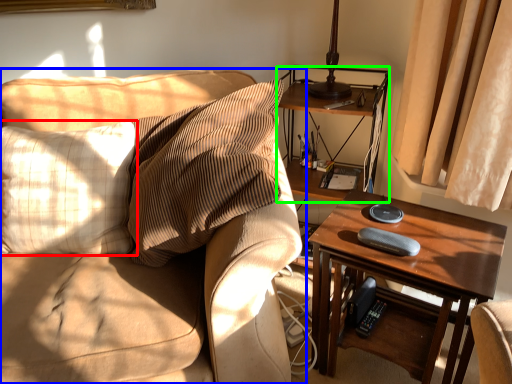
Question: Considering the real-world distances, which object is closest to pillow (highlighted by a red box)? studio couch (highlighted by a blue box) or shelf (highlighted by a green box).

Choices:
 (A) studio couch
 (B) shelf

Answer: (A)